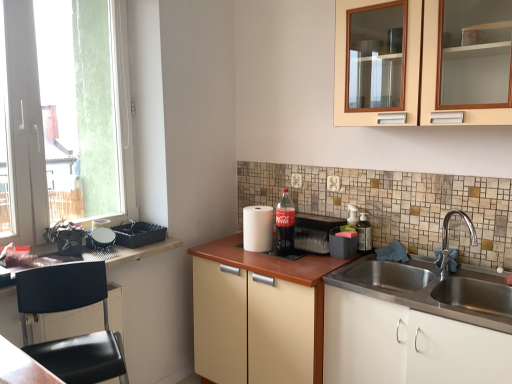
This screenshot has width=512, height=384. What do you see at coordinates (257, 228) in the screenshot?
I see `white paper towel at center, placed as the 3th appliance when sorted from right to left` at bounding box center [257, 228].

Describe the element at coordinates (342, 244) in the screenshot. The image size is (512, 384). I see `matte black tissue box at center, which is counted as the 1th appliance, starting from the right` at that location.

This screenshot has width=512, height=384. In order to click on transparent glass window at left in this screenshot , I will do `click(63, 116)`.

Identify the location of polished chrome faucet at sink right. tap(447, 241).

Measure the distance between point (298, 241) and camera.

Point (298, 241) and camera are 7.92 feet apart from each other.

The width and height of the screenshot is (512, 384). What do you see at coordinates (142, 251) in the screenshot?
I see `wooden countertop at left` at bounding box center [142, 251].

Locate an element on the screen. The image size is (512, 384). beige wood cabinet at upper center, acting as the fourth cabinetry starting from the bottom is located at coordinates (433, 73).

From a real-world perspective, is polished chrome faucet at sink right positioned under beige wood cabinet at upper center, acting as the fourth cabinetry starting from the bottom, based on gravity?

Yes, from a real-world perspective, polished chrome faucet at sink right is below beige wood cabinet at upper center, acting as the fourth cabinetry starting from the bottom.

From the image's perspective, is polished chrome faucet at sink right located beneath beige wood cabinet at upper center, the first cabinetry viewed from the top?

Yes, from the image's perspective, polished chrome faucet at sink right is below beige wood cabinet at upper center, the first cabinetry viewed from the top.

Between point (448, 272) and point (341, 88), which one is positioned in front?

The point (341, 88) is in front.

Would you say polished chrome faucet at sink right is a long distance from beige wood cabinet at upper center, the first cabinetry viewed from the top?

polished chrome faucet at sink right is near beige wood cabinet at upper center, the first cabinetry viewed from the top, not far away.

Relative to polished chrome faucet at sink right, is beige wood cabinet at upper center, the first cabinetry viewed from the top, in front or behind?

beige wood cabinet at upper center, the first cabinetry viewed from the top, is positioned closer to the viewer than polished chrome faucet at sink right.

Which is farther, (419, 19) or (437, 267)?

Positioned behind is point (437, 267).

How far apart are beige wood cabinet at upper center, acting as the fourth cabinetry starting from the bottom, and polished chrome faucet at sink right?

They are 27.86 inches apart.

How many degrees apart are the facing directions of beige wood cabinet at upper center, the first cabinetry viewed from the top, and polished chrome faucet at sink right?

beige wood cabinet at upper center, the first cabinetry viewed from the top, and polished chrome faucet at sink right are facing 80.4 degrees away from each other.

Is transparent glass window at left looking in the opposite direction of white paper towel at center, placed as the second appliance when sorted from left to right?

transparent glass window at left is not turned away from white paper towel at center, placed as the second appliance when sorted from left to right.

The height and width of the screenshot is (384, 512). I want to click on window above the white paper towel at center, placed as the second appliance when sorted from left to right (from a real-world perspective), so click(x=63, y=116).

In terms of size, does transparent glass window at left appear bigger or smaller than white paper towel at center, placed as the 3th appliance when sorted from right to left?

In the image, transparent glass window at left appears to be larger than white paper towel at center, placed as the 3th appliance when sorted from right to left.

Is transparent glass window at left not near white paper towel at center, placed as the 3th appliance when sorted from right to left?

Yes, transparent glass window at left and white paper towel at center, placed as the 3th appliance when sorted from right to left, are quite far apart.

Which is closer, (x=146, y=240) or (x=288, y=194)?

The point (x=146, y=240) is closer.

At what (x,y) coordinates should I click in order to perform the action: click on bottle in front of the black plastic tray at left, positioned as the 4th appliance in right-to-left order. Please return your answer as a coordinate pair (x, y). This screenshot has height=384, width=512. Looking at the image, I should click on (285, 224).

Considering the relative positions of black plastic tray at left, positioned as the 4th appliance in right-to-left order, and coca-cola bottle at center, the 1th bottle positioned from the left, in the image provided, is black plastic tray at left, positioned as the 4th appliance in right-to-left order, in front of coca-cola bottle at center, the 1th bottle positioned from the left,?

No, it is behind coca-cola bottle at center, the 1th bottle positioned from the left.

What are the coordinates of `the 2nd appliance below the beige wood cabinet at upper center, acting as the fourth cabinetry starting from the bottom (from the image's perspective)` in the screenshot? It's located at (314, 232).

Can you confirm if beige wood cabinet at upper center, acting as the fourth cabinetry starting from the bottom, is taller than matte plastic soda at center, acting as the third appliance starting from the left?

Yes.

Are beige wood cabinet at upper center, the first cabinetry viewed from the top, and matte plastic soda at center, which is the 2th appliance in right-to-left order, far apart?

No, there isn't a large distance between beige wood cabinet at upper center, the first cabinetry viewed from the top, and matte plastic soda at center, which is the 2th appliance in right-to-left order.

Between beige wood cabinet at upper center, the first cabinetry viewed from the top, and matte plastic soda at center, acting as the third appliance starting from the left, which one is positioned in front?

beige wood cabinet at upper center, the first cabinetry viewed from the top, is more forward.

Which is more distant, (332, 232) or (445, 108)?

The point (332, 232) is more distant.

From the image's perspective, is matte black tissue box at center, the fourth appliance in the left-to-right sequence, located above or below beige wood cabinet at upper center, acting as the fourth cabinetry starting from the bottom?

From the image's perspective, matte black tissue box at center, the fourth appliance in the left-to-right sequence, appears below beige wood cabinet at upper center, acting as the fourth cabinetry starting from the bottom.

Could beige wood cabinet at upper center, acting as the fourth cabinetry starting from the bottom, be considered to be inside matte black tissue box at center, which is counted as the 1th appliance, starting from the right?

No.

Which point is more distant from viewer, (289, 228) or (261, 247)?

The point (261, 247) is behind.

Is coca-cola bottle at center, the 1th bottle positioned from the left, located outside white paper towel at center, placed as the second appliance when sorted from left to right?

Absolutely, coca-cola bottle at center, the 1th bottle positioned from the left, is external to white paper towel at center, placed as the second appliance when sorted from left to right.

How far apart are coca-cola bottle at center, the 1th bottle positioned from the left, and white paper towel at center, placed as the second appliance when sorted from left to right?

coca-cola bottle at center, the 1th bottle positioned from the left, is 3.79 inches from white paper towel at center, placed as the second appliance when sorted from left to right.

Is coca-cola bottle at center, the second bottle positioned from the right, wider or thinner than white paper towel at center, placed as the 3th appliance when sorted from right to left?

In the image, coca-cola bottle at center, the second bottle positioned from the right, appears to be more narrow than white paper towel at center, placed as the 3th appliance when sorted from right to left.

I want to click on tap behind the beige wood cabinet at upper center, the first cabinetry viewed from the top, so click(447, 241).

Where is `tap that appears below the beige wood cabinet at upper center, the first cabinetry viewed from the top (from a real-world perspective)`? The width and height of the screenshot is (512, 384). tap that appears below the beige wood cabinet at upper center, the first cabinetry viewed from the top (from a real-world perspective) is located at coordinates (447, 241).

Based on their spatial positions, is matte plastic soda at center, which is the 2th appliance in right-to-left order, or white matte cabinet at lower right, the fourth cabinetry positioned from the top, closer to coca-cola bottle at center, the 1th bottle positioned from the left?

matte plastic soda at center, which is the 2th appliance in right-to-left order, is closer to coca-cola bottle at center, the 1th bottle positioned from the left.

When comparing their distances from white paper towel at center, placed as the second appliance when sorted from left to right, does polished chrome faucet at sink right or black plastic tray at left, positioned as the 4th appliance in right-to-left order, seem closer?

Based on the image, black plastic tray at left, positioned as the 4th appliance in right-to-left order, appears to be nearer to white paper towel at center, placed as the second appliance when sorted from left to right.

Based on their spatial positions, is wooden countertop at left or beige wood cabinet at upper center, the first cabinetry viewed from the top, closer to polished chrome faucet at sink right?

beige wood cabinet at upper center, the first cabinetry viewed from the top, is positioned closer to the anchor polished chrome faucet at sink right.

When comparing their distances from black plastic chair at lower left, which is the 2th cabinetry from top to bottom, does polished chrome faucet at sink right or beige wood cabinet at upper center, the first cabinetry viewed from the top, seem closer?

Based on the image, beige wood cabinet at upper center, the first cabinetry viewed from the top, appears to be nearer to black plastic chair at lower left, which is the 2th cabinetry from top to bottom.

Based on their spatial positions, is matte black tissue box at center, the fourth appliance in the left-to-right sequence, or beige wood cabinet at upper center, the first cabinetry viewed from the top, further from coca-cola bottle at center, the 1th bottle positioned from the left?

Among the two, beige wood cabinet at upper center, the first cabinetry viewed from the top, is located further to coca-cola bottle at center, the 1th bottle positioned from the left.

When comparing their distances from polished chrome faucet at sink right, does beige wood cabinet at upper center, the first cabinetry viewed from the top, or white matte cabinet at lower right, placed as the 1th cabinetry when sorted from bottom to top, seem further?

beige wood cabinet at upper center, the first cabinetry viewed from the top, is positioned further to the anchor polished chrome faucet at sink right.

When comparing their distances from white paper towel at center, placed as the 3th appliance when sorted from right to left, does translucent plastic soap dispenser at right, marked as the second bottle in a left-to-right arrangement, or matte black tissue box at center, the fourth appliance in the left-to-right sequence, seem closer?

matte black tissue box at center, the fourth appliance in the left-to-right sequence.

Which object lies further to the anchor point white matte cabinet at lower right, placed as the 1th cabinetry when sorted from bottom to top, transparent glass window at left or beige wood cabinet at upper center, the first cabinetry viewed from the top?

Based on the image, transparent glass window at left appears to be further to white matte cabinet at lower right, placed as the 1th cabinetry when sorted from bottom to top.

At what (x,y) coordinates should I click in order to perform the action: click on appliance between coca-cola bottle at center, the second bottle positioned from the right, and matte black tissue box at center, which is counted as the 1th appliance, starting from the right. Please return your answer as a coordinate pair (x, y). Looking at the image, I should click on (314, 232).

In order to click on bottle between matte plastic soda at center, which is the 2th appliance in right-to-left order, and polished chrome faucet at sink right from left to right in this screenshot , I will do `click(364, 234)`.

The image size is (512, 384). Identify the location of countertop situated between transparent glass window at left and white paper towel at center, placed as the second appliance when sorted from left to right, from left to right. (142, 251).

What are the coordinates of `tap positioned between white matte cabinet at lower right, placed as the 1th cabinetry when sorted from bottom to top, and translucent plastic soap dispenser at right, marked as the second bottle in a left-to-right arrangement, from near to far` in the screenshot? It's located at (447, 241).